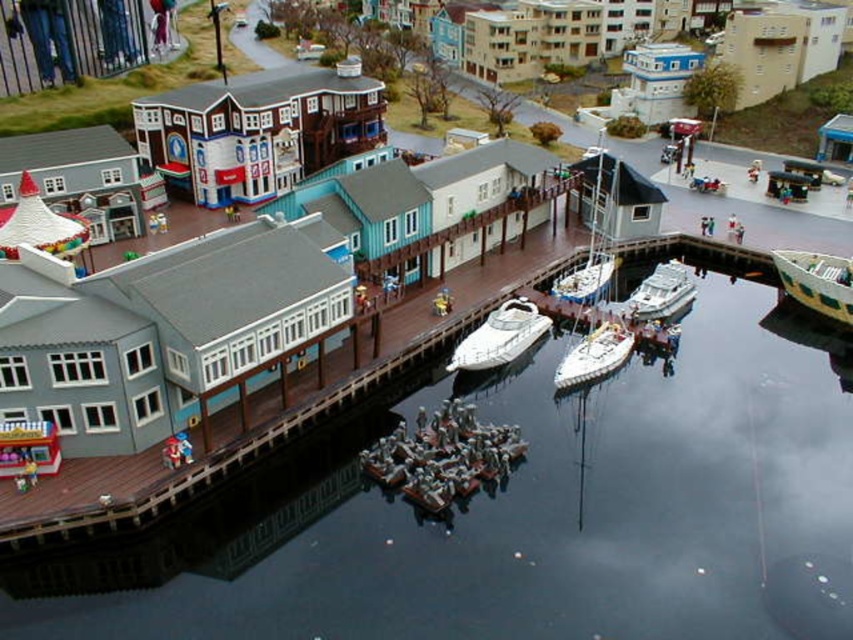
Does metallic silver boats at center have a smaller size compared to white glossy speedboat at center?

No, metallic silver boats at center is not smaller than white glossy speedboat at center.

How far apart are metallic silver boats at center and white glossy speedboat at center?

metallic silver boats at center is 8.11 meters from white glossy speedboat at center.

Is point (451, 400) positioned after point (517, 321)?

No.

The height and width of the screenshot is (640, 853). I want to click on metallic silver boats at center, so click(x=444, y=456).

Is white glossy sailboat at center closer to camera compared to white matte sailboat at center?

Yes, it is.

Between white glossy sailboat at center and white matte sailboat at center, which one is positioned higher?

white matte sailboat at center is higher up.

Who is more forward, (x=614, y=326) or (x=595, y=260)?

Point (x=614, y=326) is in front.

Identify the location of white glossy sailboat at center. Image resolution: width=853 pixels, height=640 pixels. (595, 355).

Who is taller, black glossy water at center or wooden dock at center?

With more height is wooden dock at center.

Based on the photo, is black glossy water at center taller than wooden dock at center?

No.

Which is in front, point (521, 616) or point (509, 285)?

Point (521, 616)

Identify the location of black glossy water at center. [x=521, y=509].